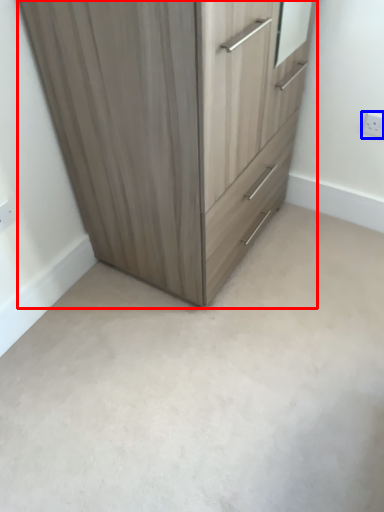
Question: Which object appears closest to the camera in this image, chest of drawers (highlighted by a red box) or electric outlet (highlighted by a blue box)?

Choices:
 (A) chest of drawers
 (B) electric outlet

Answer: (A)